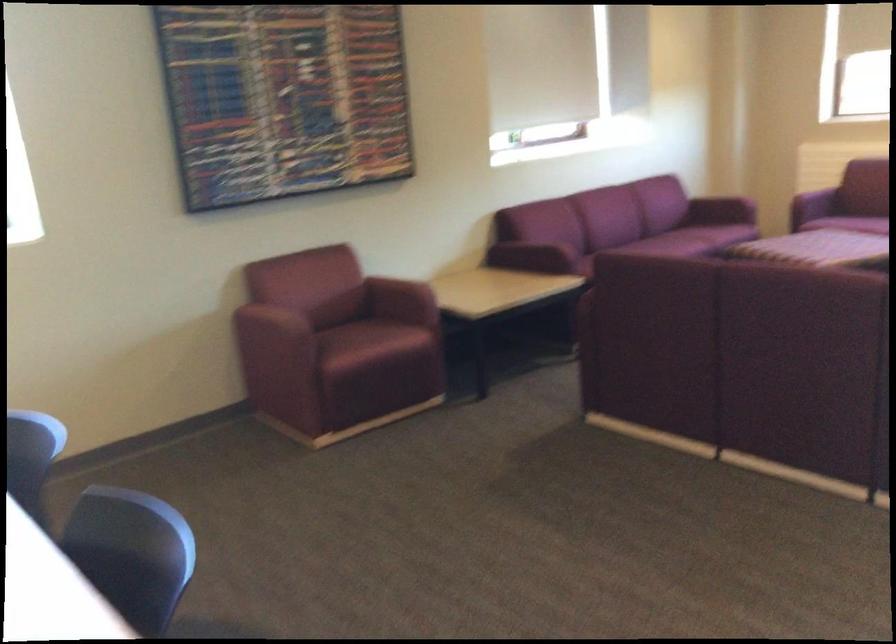
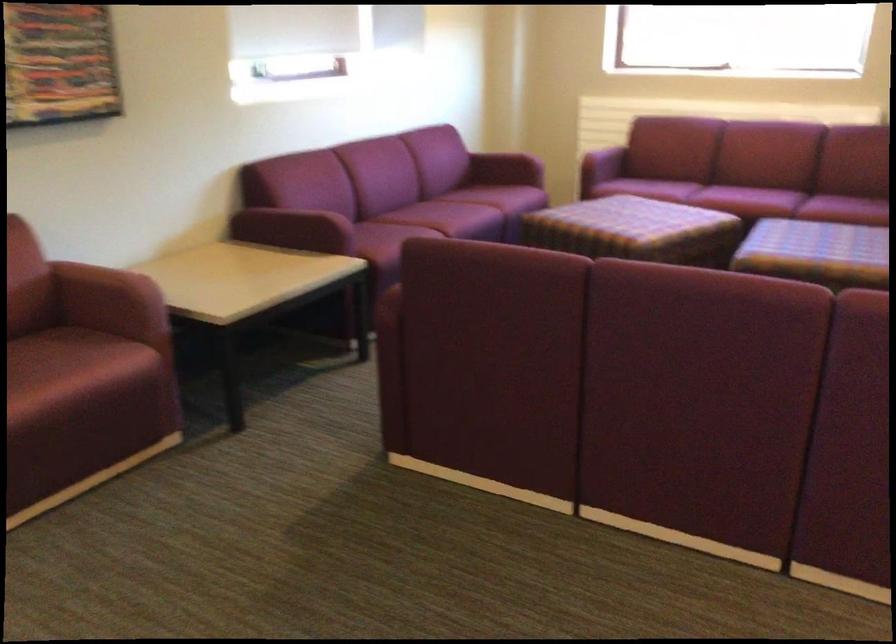
Question: The camera is either moving clockwise (left) or counter-clockwise (right) around the object. The first image is from the beginning of the video and the second image is from the end. Is the camera moving left or right when shooting the video?

Choices:
 (A) Left
 (B) Right

Answer: (A)